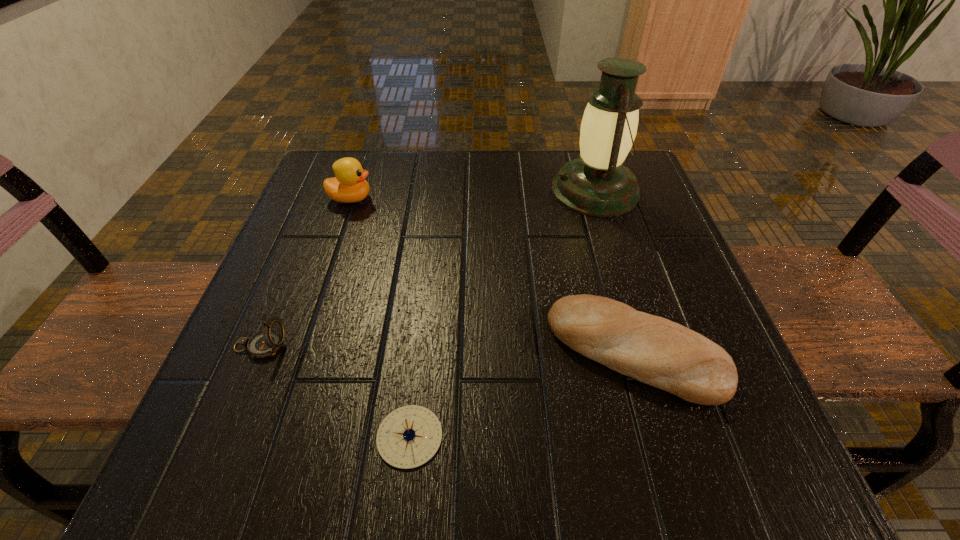
Image resolution: width=960 pixels, height=540 pixels. Identify the location of the tallest object. (597, 183).

Locate an element on the screen. This screenshot has height=540, width=960. duckling is located at coordinates (349, 185).

Where is `the left compass`? This screenshot has height=540, width=960. the left compass is located at coordinates (265, 343).

You are a GUI agent. You are given a task and a screenshot of the screen. Output one action in this format:
    pyautogui.click(x=<x>, y=<y>)
    Task: Click on the farther compass
    
    Given the screenshot: What is the action you would take?
    pyautogui.click(x=265, y=343)

Find the location of a particular element. The image size is (960, 540). bread is located at coordinates (653, 350).

Image resolution: width=960 pixels, height=540 pixels. I want to click on the shorter compass, so click(x=408, y=437).

Locate an element on the screen. Image resolution: width=960 pixels, height=540 pixels. the nearer compass is located at coordinates (408, 437).

I want to click on vacant space located with the light compartment facing forward on the tallest object, so click(x=438, y=190).

This screenshot has height=540, width=960. What are the coordinates of `vacant space positioned with the light compartment facing forward on the tallest object` in the screenshot? It's located at (506, 190).

At what (x,y) coordinates should I click in order to perform the action: click on vacant space located 0.140m with the light compartment facing forward on the tallest object. Please return your answer as a coordinate pair (x, y). The image size is (960, 540). Looking at the image, I should click on (488, 190).